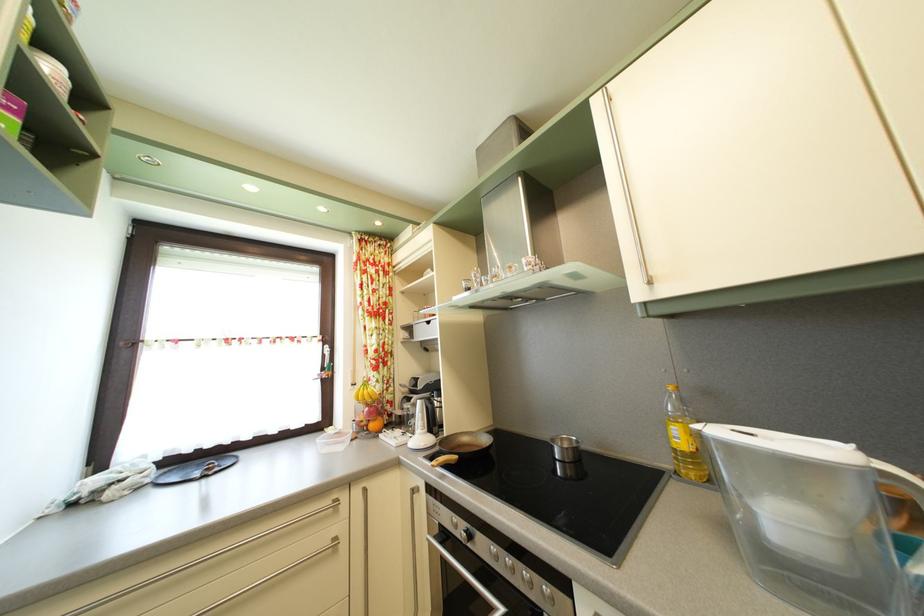
Where is `pan handle`? pan handle is located at coordinates (706, 402).